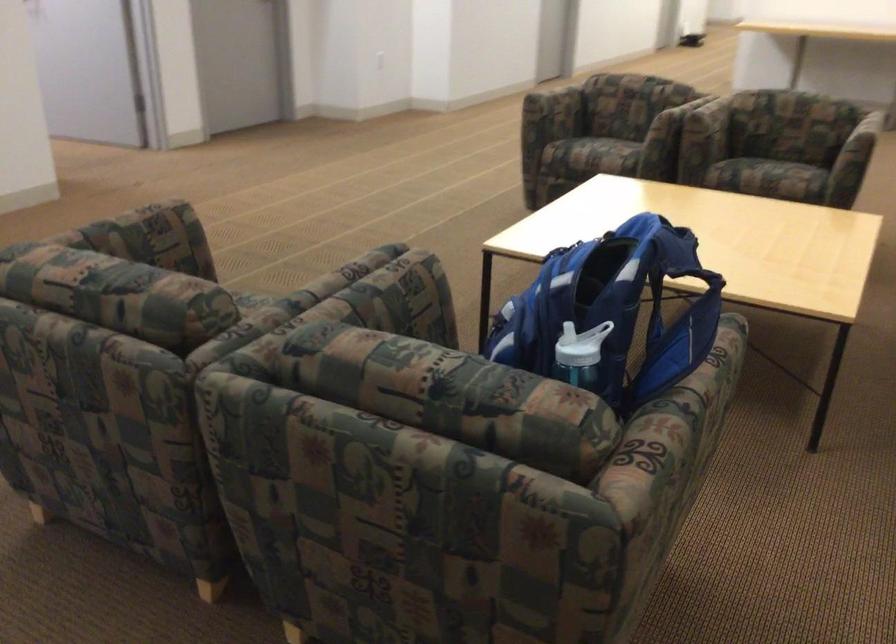
This screenshot has height=644, width=896. Identify the location of white water bottle lid. (574, 348).